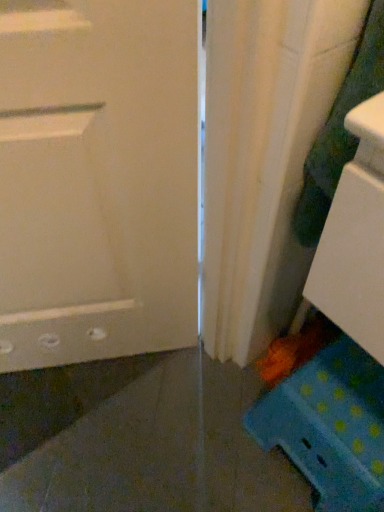
Question: In terms of height, does green textured fabric at right look taller or shorter compared to blue polka dot stool at lower right?

Choices:
 (A) short
 (B) tall

Answer: (B)

Question: Is green textured fabric at right inside or outside of blue polka dot stool at lower right?

Choices:
 (A) inside
 (B) outside

Answer: (B)

Question: Is point (332, 138) positioned closer to the camera than point (364, 501)?

Choices:
 (A) farther
 (B) closer

Answer: (B)

Question: From a real-world perspective, is blue polka dot stool at lower right physically located above or below green textured fabric at right?

Choices:
 (A) above
 (B) below

Answer: (B)

Question: Is blue polka dot stool at lower right spatially inside green textured fabric at right, or outside of it?

Choices:
 (A) outside
 (B) inside

Answer: (A)

Question: Is blue polka dot stool at lower right to the left or to the right of green textured fabric at right in the image?

Choices:
 (A) right
 (B) left

Answer: (A)

Question: Considering the positions of blue polka dot stool at lower right and green textured fabric at right in the image, is blue polka dot stool at lower right taller or shorter than green textured fabric at right?

Choices:
 (A) short
 (B) tall

Answer: (A)